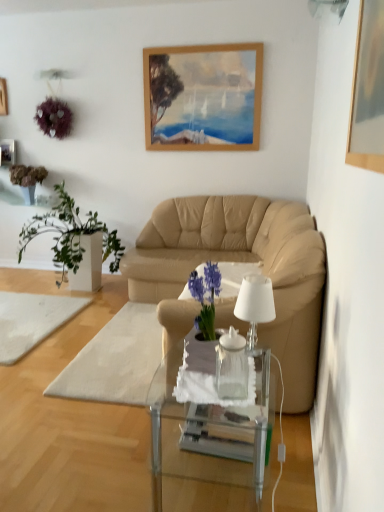
Question: From the image's perspective, is metallic silver picture frame at upper left, the second picture frame from the bottom, under white glass lamp at center?

Choices:
 (A) no
 (B) yes

Answer: (A)

Question: Does metallic silver picture frame at upper left, which is counted as the 2th picture frame, starting from the top, come in front of white glass lamp at center?

Choices:
 (A) yes
 (B) no

Answer: (B)

Question: Is metallic silver picture frame at upper left, which is the 3th picture frame from front to back, to the left of white glass lamp at center from the viewer's perspective?

Choices:
 (A) yes
 (B) no

Answer: (A)

Question: Is metallic silver picture frame at upper left, which is counted as the first picture frame, starting from the back, touching white glass lamp at center?

Choices:
 (A) no
 (B) yes

Answer: (A)

Question: Is metallic silver picture frame at upper left, placed as the 2th picture frame when sorted from right to left, far away from white glass lamp at center?

Choices:
 (A) no
 (B) yes

Answer: (B)

Question: Is metallic silver picture frame at upper left, which is the 2th picture frame in left-to-right order, to the right of white glass lamp at center from the viewer's perspective?

Choices:
 (A) no
 (B) yes

Answer: (A)

Question: Is white glass lamp at center taller than transparent glass coffee table at center?

Choices:
 (A) yes
 (B) no

Answer: (B)

Question: From a real-world perspective, does white glass lamp at center sit lower than transparent glass coffee table at center?

Choices:
 (A) no
 (B) yes

Answer: (A)

Question: Can you confirm if white glass lamp at center is shorter than transparent glass coffee table at center?

Choices:
 (A) no
 (B) yes

Answer: (B)

Question: Can we say white glass lamp at center lies outside transparent glass coffee table at center?

Choices:
 (A) yes
 (B) no

Answer: (A)

Question: Is white glass lamp at center facing towards transparent glass coffee table at center?

Choices:
 (A) no
 (B) yes

Answer: (A)

Question: Is white glass lamp at center next to transparent glass coffee table at center?

Choices:
 (A) no
 (B) yes

Answer: (A)

Question: Does white fabric footrest at center appear on the left side of green leafy plant at left, which appears as the second houseplant when viewed from the left?

Choices:
 (A) no
 (B) yes

Answer: (A)